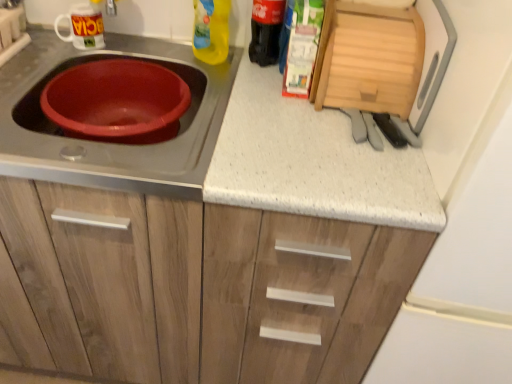
Question: Is white glossy mug at upper left, the second appliance in the right-to-left sequence, closer to the viewer compared to yellow plastic bottle at upper center, which is the 2th bottle in right-to-left order?

Choices:
 (A) no
 (B) yes

Answer: (A)

Question: Is yellow plastic bottle at upper center, the 1th bottle viewed from the left, completely or partially inside white glossy mug at upper left, the second appliance in the right-to-left sequence?

Choices:
 (A) no
 (B) yes

Answer: (A)

Question: Can you confirm if white glossy mug at upper left, placed as the first appliance when sorted from left to right, is positioned to the right of yellow plastic bottle at upper center, which is the 2th bottle in right-to-left order?

Choices:
 (A) no
 (B) yes

Answer: (A)

Question: Does white glossy mug at upper left, the second appliance in the right-to-left sequence, turn towards yellow plastic bottle at upper center, the 1th bottle viewed from the left?

Choices:
 (A) yes
 (B) no

Answer: (B)

Question: Can you confirm if white glossy mug at upper left, the second appliance in the right-to-left sequence, is bigger than yellow plastic bottle at upper center, the 1th bottle viewed from the left?

Choices:
 (A) yes
 (B) no

Answer: (B)

Question: From a real-world perspective, is wooden cutting board at upper right, the first appliance viewed from the right, above or below matte plastic basin at left?

Choices:
 (A) above
 (B) below

Answer: (A)

Question: Relative to matte plastic basin at left, is wooden cutting board at upper right, the first appliance viewed from the right, in front or behind?

Choices:
 (A) behind
 (B) front

Answer: (A)

Question: Looking at their shapes, would you say wooden cutting board at upper right, the first appliance viewed from the right, is wider or thinner than matte plastic basin at left?

Choices:
 (A) thin
 (B) wide

Answer: (A)

Question: Is wooden cutting board at upper right, the first appliance viewed from the right, taller or shorter than matte plastic basin at left?

Choices:
 (A) short
 (B) tall

Answer: (B)

Question: From the image's perspective, is matte plastic basin at left above or below wooden cutting board at upper right, the first appliance viewed from the right?

Choices:
 (A) below
 (B) above

Answer: (A)

Question: Is matte plastic basin at left inside or outside of wooden cutting board at upper right, the first appliance viewed from the right?

Choices:
 (A) outside
 (B) inside

Answer: (A)

Question: Is matte plastic basin at left taller or shorter than wooden cutting board at upper right, the first appliance viewed from the right?

Choices:
 (A) short
 (B) tall

Answer: (A)

Question: Is point (6, 162) closer or farther from the camera than point (368, 107)?

Choices:
 (A) closer
 (B) farther

Answer: (A)

Question: Considering the positions of white speckled laminate at center and white glossy mug at upper left, the second appliance in the right-to-left sequence, in the image, is white speckled laminate at center wider or thinner than white glossy mug at upper left, the second appliance in the right-to-left sequence,?

Choices:
 (A) thin
 (B) wide

Answer: (B)

Question: From their relative heights in the image, would you say white speckled laminate at center is taller or shorter than white glossy mug at upper left, placed as the first appliance when sorted from left to right?

Choices:
 (A) short
 (B) tall

Answer: (B)